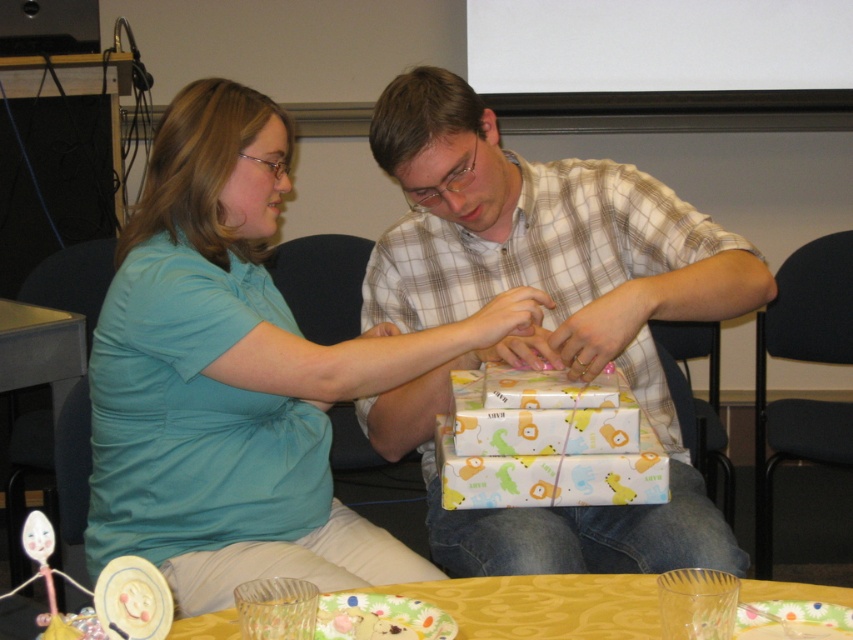
Between matte teal shirt at center and plaid shirt at center, which one is positioned higher?

Positioned higher is plaid shirt at center.

Is matte teal shirt at center to the right of plaid shirt at center from the viewer's perspective?

In fact, matte teal shirt at center is to the left of plaid shirt at center.

The height and width of the screenshot is (640, 853). What do you see at coordinates (236, 376) in the screenshot? I see `matte teal shirt at center` at bounding box center [236, 376].

At what (x,y) coordinates should I click in order to perform the action: click on matte teal shirt at center. Please return your answer as a coordinate pair (x, y). Looking at the image, I should click on (236, 376).

Which is below, plaid shirt at center or yellow fabric table at lower center?

Positioned lower is yellow fabric table at lower center.

Can you confirm if plaid shirt at center is positioned below yellow fabric table at lower center?

Incorrect, plaid shirt at center is not positioned below yellow fabric table at lower center.

The width and height of the screenshot is (853, 640). What do you see at coordinates (544, 316) in the screenshot?
I see `plaid shirt at center` at bounding box center [544, 316].

Locate an element on the screen. plaid shirt at center is located at coordinates (544, 316).

From the picture: Does matte teal shirt at center have a smaller size compared to yellow fabric table at lower center?

Actually, matte teal shirt at center might be larger than yellow fabric table at lower center.

Which is more to the left, matte teal shirt at center or yellow fabric table at lower center?

From the viewer's perspective, matte teal shirt at center appears more on the left side.

Which is in front, point (260, 320) or point (590, 614)?

Point (590, 614)

You are a GUI agent. You are given a task and a screenshot of the screen. Output one action in this format:
    pyautogui.click(x=<x>, y=<y>)
    Task: Click on the matte teal shirt at center
    
    Given the screenshot: What is the action you would take?
    pyautogui.click(x=236, y=376)